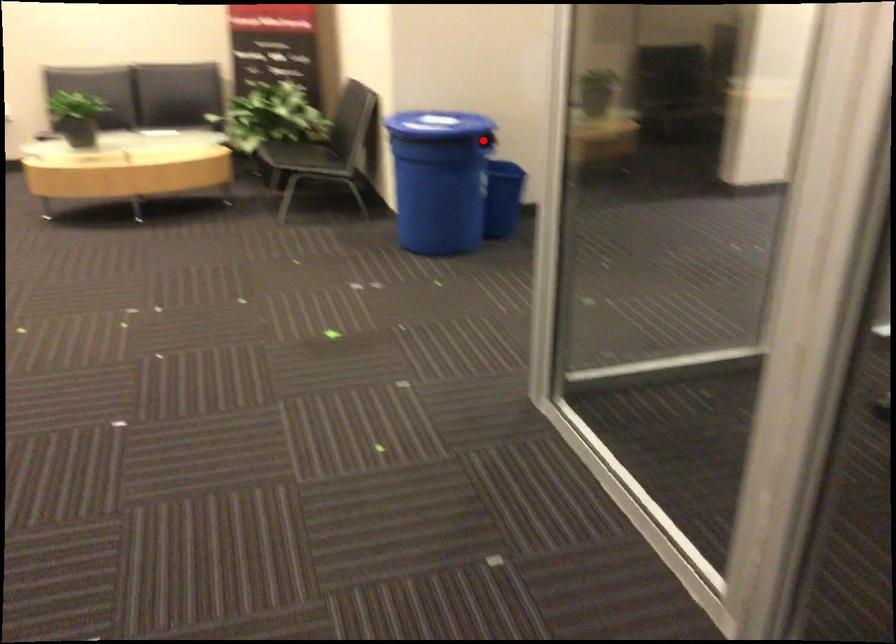
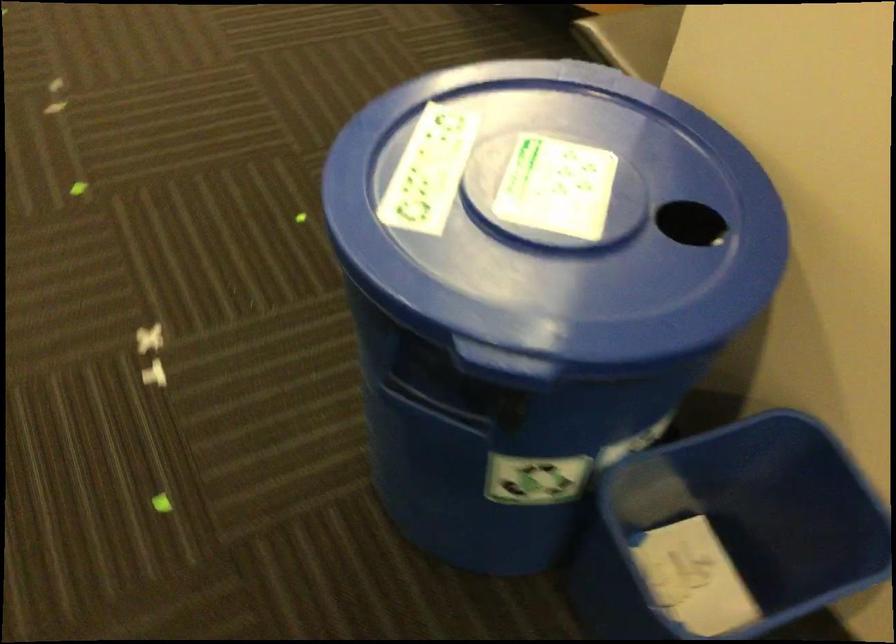
Question: I am providing you with two images of the same scene from different viewpoints. Image1 has a red point marked. In image2, the corresponding 3D location appears at what relative position? Reply with the corresponding letter.

Choices:
 (A) Closer
 (B) Farther

Answer: (A)